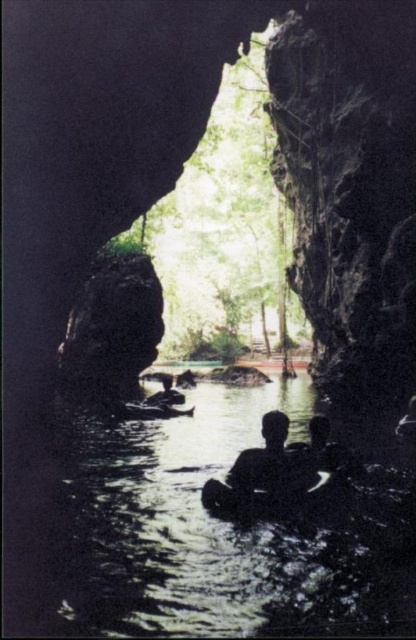
Question: Among these objects, which one is nearest to the camera?

Choices:
 (A) silhouette human at center
 (B) black rubber raft at center
 (C) wooden canoe at center

Answer: (B)

Question: Considering the relative positions of black rubber raft at center and wooden canoe at center in the image provided, where is black rubber raft at center located with respect to wooden canoe at center?

Choices:
 (A) left
 (B) right

Answer: (B)

Question: Does black rubber raft at center appear under wooden canoe at center?

Choices:
 (A) no
 (B) yes

Answer: (B)

Question: Does black rubber raft at center lie in front of silhouette human at center?

Choices:
 (A) no
 (B) yes

Answer: (B)

Question: Which point appears closest to the camera in this image?

Choices:
 (A) (210, 404)
 (B) (408, 408)

Answer: (B)

Question: Which of the following is the closest to the observer?

Choices:
 (A) (123, 404)
 (B) (121, 604)
 (C) (411, 420)

Answer: (B)